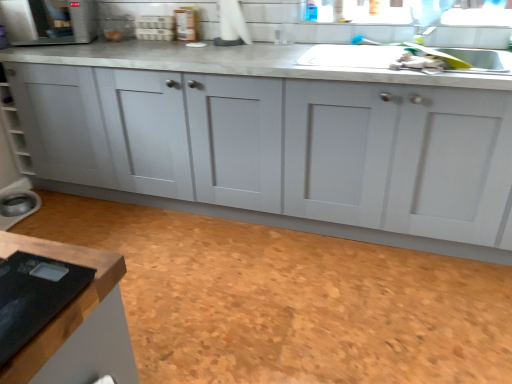
Question: From the image's perspective, is brown cork floor at lower center located above or below satin silver microwave at upper left, the 2th appliance viewed from the left?

Choices:
 (A) below
 (B) above

Answer: (A)

Question: Looking at the image, does brown cork floor at lower center seem bigger or smaller compared to satin silver microwave at upper left, which is counted as the 4th appliance, starting from the bottom?

Choices:
 (A) big
 (B) small

Answer: (A)

Question: Which object is the farthest from the white plastic egg carton at upper center, which ranks as the 3th appliance in left-to-right order?

Choices:
 (A) white matte cabinet at center
 (B) matte brown jar at upper center, positioned as the 2th appliance in bottom-to-top order
 (C) brown cork floor at lower center
 (D) satin silver microwave at upper left, which is counted as the 4th appliance, starting from the bottom
 (E) matte white kettle at lower left, the 1th appliance from the bottom

Answer: (C)

Question: Estimate the real-world distances between objects in this image. Which object is closer to the white plastic egg carton at upper center, which ranks as the 3th appliance in left-to-right order?

Choices:
 (A) matte brown jar at upper center, the 1th appliance positioned from the right
 (B) brown cork floor at lower center
 (C) white matte cabinet at center
 (D) satin silver microwave at upper left, placed as the 3th appliance when sorted from right to left
 (E) matte white kettle at lower left, the 1th appliance when ordered from left to right

Answer: (A)